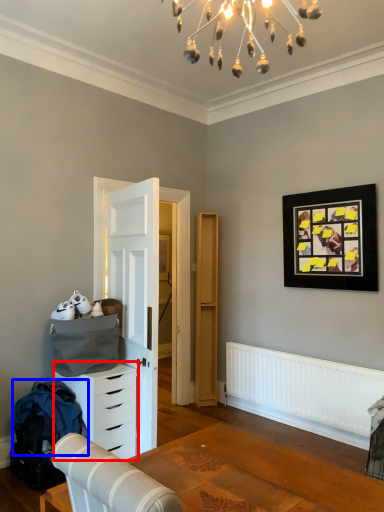
Question: Among these objects, which one is nearest to the camera, chest of drawers (highlighted by a red box) or laundry (highlighted by a blue box)?

Choices:
 (A) chest of drawers
 (B) laundry

Answer: (B)